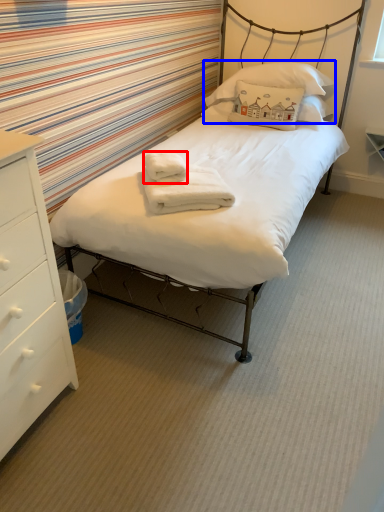
Question: Which object is closer to the camera taking this photo, bath towel (highlighted by a red box) or pillow (highlighted by a blue box)?

Choices:
 (A) bath towel
 (B) pillow

Answer: (A)